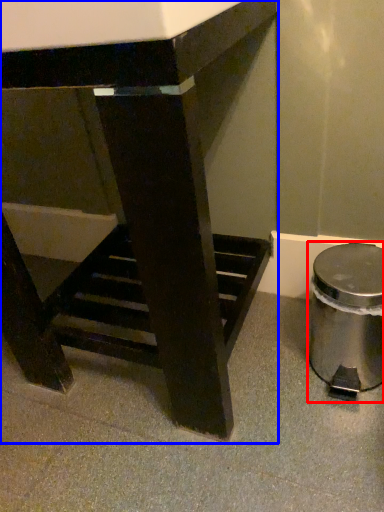
Question: Which of the following is the closest to the observer, waste container (highlighted by a red box) or table (highlighted by a blue box)?

Choices:
 (A) waste container
 (B) table

Answer: (B)